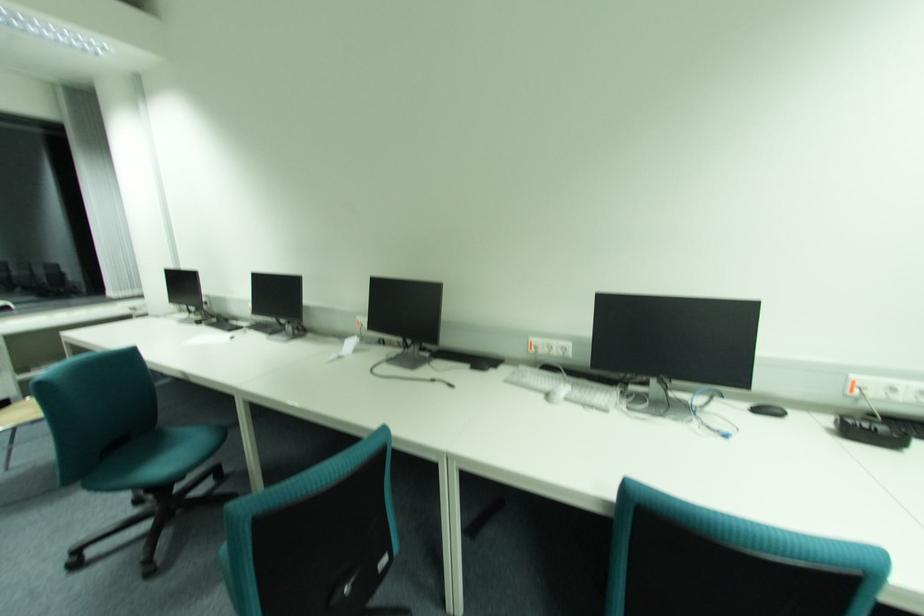
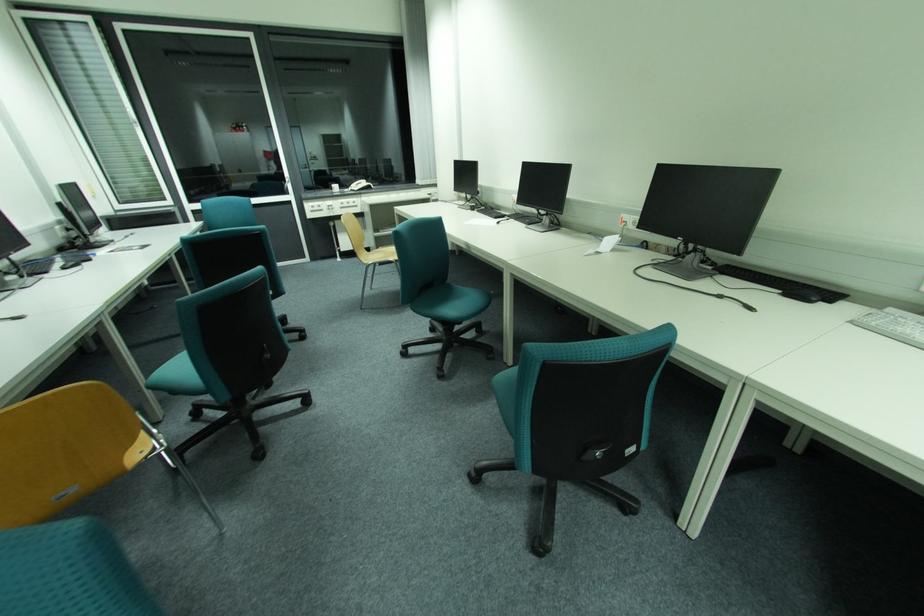
The first image is from the beginning of the video and the second image is from the end. How did the camera likely rotate when shooting the video?

The rotation direction of the camera is left-down.